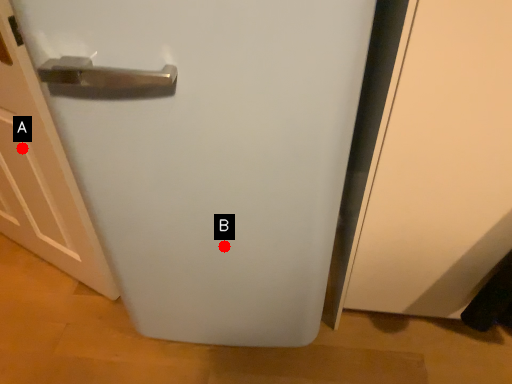
Question: Two points are circled on the image, labeled by A and B beside each circle. Which of the following is the closest to the observer?

Choices:
 (A) A is closer
 (B) B is closer

Answer: (B)